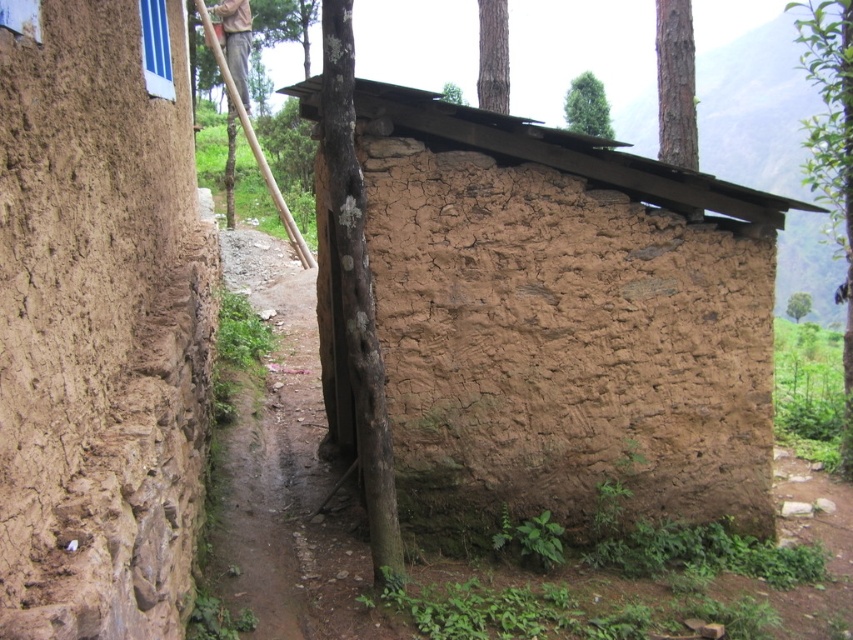
Is brown mud hut at center wider than dusty dirt path at center?

Incorrect, brown mud hut at center's width does not surpass dusty dirt path at center's.

Between brown mud hut at center and dusty dirt path at center, which one is positioned higher?

Positioned higher is brown mud hut at center.

The width and height of the screenshot is (853, 640). What do you see at coordinates (563, 321) in the screenshot?
I see `brown mud hut at center` at bounding box center [563, 321].

Locate an element on the screen. brown mud hut at center is located at coordinates 563,321.